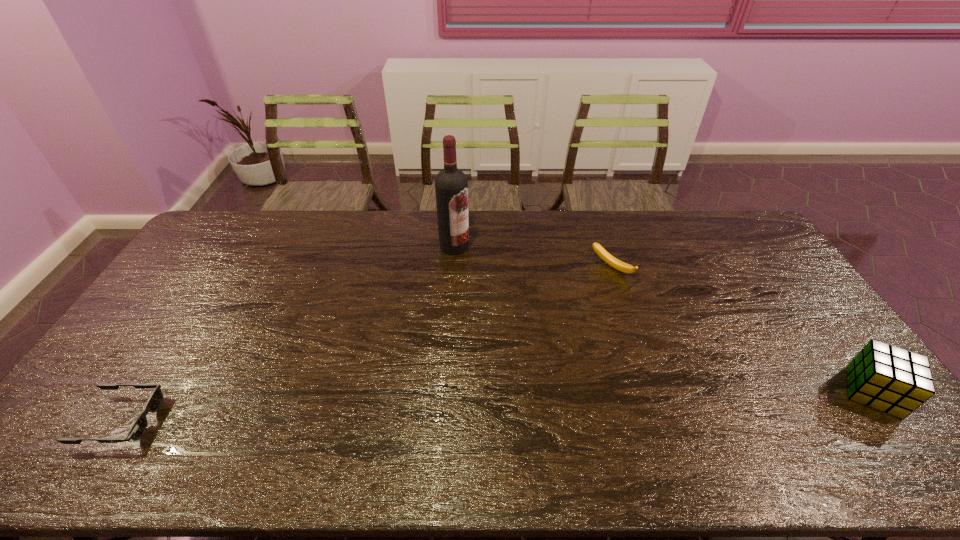
Locate an element on the screen. free spot on the desktop that is between the sunglasses and the second tallest object and is positioned on the label of the tallest object is located at coordinates (615, 402).

You are a GUI agent. You are given a task and a screenshot of the screen. Output one action in this format:
    pyautogui.click(x=<x>, y=<y>)
    Task: Click on the free spot on the desktop that is between the leftmost object and the second tallest object and is positioned at the stem of the third object from left to right
    
    Given the screenshot: What is the action you would take?
    pyautogui.click(x=452, y=408)